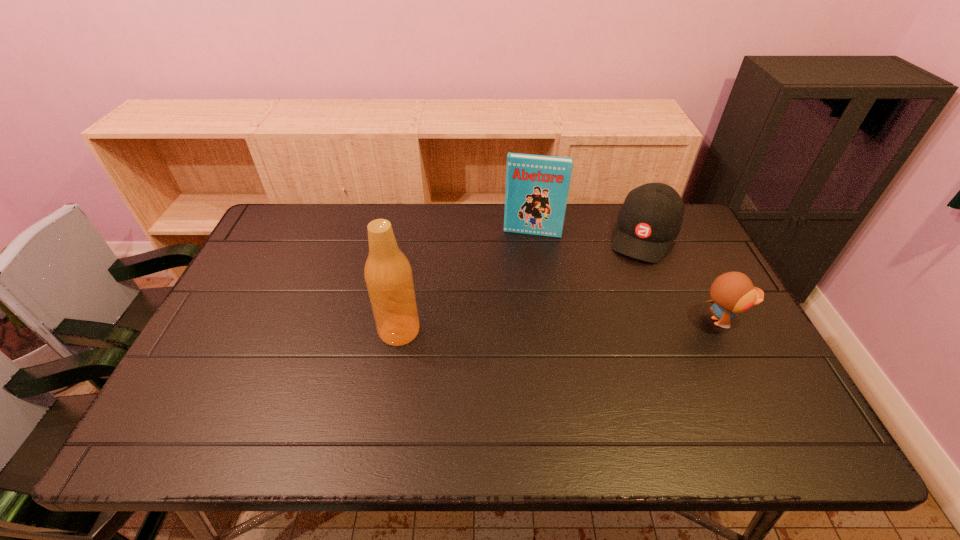
In the image, there is a desktop. What are the coordinates of `blank space at the right edge` in the screenshot? It's located at (698, 258).

The image size is (960, 540). In order to click on free location at the near left corner of the desktop in this screenshot , I will do `click(191, 375)`.

Find the location of a particular element. The height and width of the screenshot is (540, 960). free area in between the duck and the book is located at coordinates (627, 277).

I want to click on vacant area between the second object from left to right and the duck, so click(x=627, y=277).

Locate an element on the screen. unoccupied area between the baseball cap and the book is located at coordinates (588, 234).

Find the location of a particular element. This screenshot has height=540, width=960. vacant area that lies between the leftmost object and the duck is located at coordinates (561, 326).

This screenshot has width=960, height=540. In order to click on vacant point located between the third object from right to left and the beer bottle in this screenshot , I will do `click(466, 281)`.

Where is `free spot between the leftmost object and the book`? The image size is (960, 540). free spot between the leftmost object and the book is located at coordinates (466, 281).

This screenshot has width=960, height=540. I want to click on free space between the baseball cap and the duck, so click(684, 278).

I want to click on free space between the tallest object and the duck, so click(x=561, y=326).